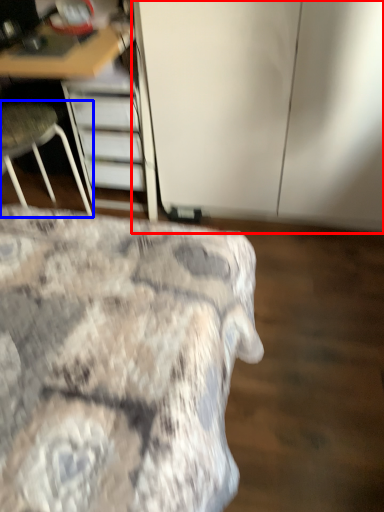
Question: Which object appears closest to the camera in this image, cabinetry (highlighted by a red box) or chair (highlighted by a blue box)?

Choices:
 (A) cabinetry
 (B) chair

Answer: (A)